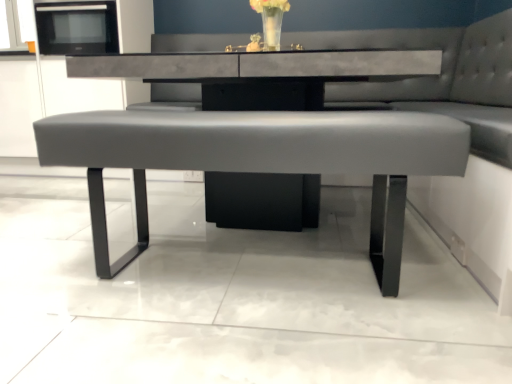
Question: Should I look upward or downward to see black matte microwave at upper left?

Choices:
 (A) up
 (B) down

Answer: (A)

Question: Should I look upward or downward to see matte gray bench at center?

Choices:
 (A) down
 (B) up

Answer: (B)

Question: Does black matte microwave at upper left contain translucent glass vase at upper center?

Choices:
 (A) no
 (B) yes

Answer: (A)

Question: Is black matte microwave at upper left at the right side of translucent glass vase at upper center?

Choices:
 (A) no
 (B) yes

Answer: (A)

Question: Does black matte microwave at upper left have a lesser width compared to translucent glass vase at upper center?

Choices:
 (A) no
 (B) yes

Answer: (A)

Question: From a real-world perspective, is black matte microwave at upper left positioned over translucent glass vase at upper center based on gravity?

Choices:
 (A) yes
 (B) no

Answer: (A)

Question: Is black matte microwave at upper left positioned before translucent glass vase at upper center?

Choices:
 (A) yes
 (B) no

Answer: (B)

Question: From the image's perspective, is black matte microwave at upper left below translucent glass vase at upper center?

Choices:
 (A) yes
 (B) no

Answer: (B)

Question: From the image's perspective, is matte gray bench at center over matte gray bench at center?

Choices:
 (A) yes
 (B) no

Answer: (A)

Question: Does matte gray bench at center appear on the right side of matte gray bench at center?

Choices:
 (A) no
 (B) yes

Answer: (B)

Question: From the image's perspective, does matte gray bench at center appear lower than matte gray bench at center?

Choices:
 (A) no
 (B) yes

Answer: (A)

Question: Is matte gray bench at center completely or partially outside of matte gray bench at center?

Choices:
 (A) no
 (B) yes

Answer: (B)

Question: Considering the relative sizes of matte gray bench at center and matte gray bench at center in the image provided, is matte gray bench at center shorter than matte gray bench at center?

Choices:
 (A) no
 (B) yes

Answer: (A)

Question: Is matte gray bench at center taller than matte gray bench at center?

Choices:
 (A) yes
 (B) no

Answer: (A)

Question: Can you see matte gray bench at center touching black matte microwave at upper left?

Choices:
 (A) yes
 (B) no

Answer: (B)